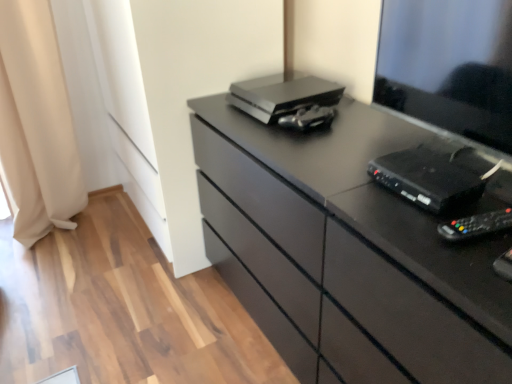
Where is `free space in front of black plastic device at right, which ranks as the 2th equipment in front-to-back order`? This screenshot has width=512, height=384. free space in front of black plastic device at right, which ranks as the 2th equipment in front-to-back order is located at coordinates (432, 238).